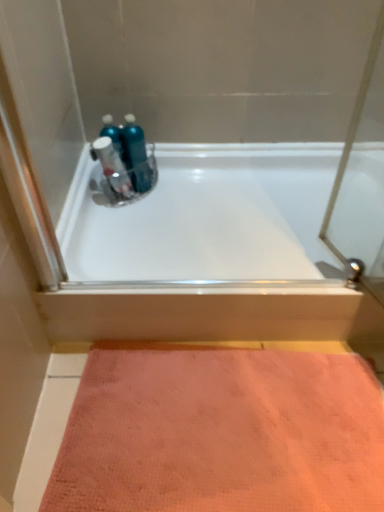
Find the location of a particular element. vacant space positioned to the left of metallic blue spray bottle at upper center is located at coordinates (94, 198).